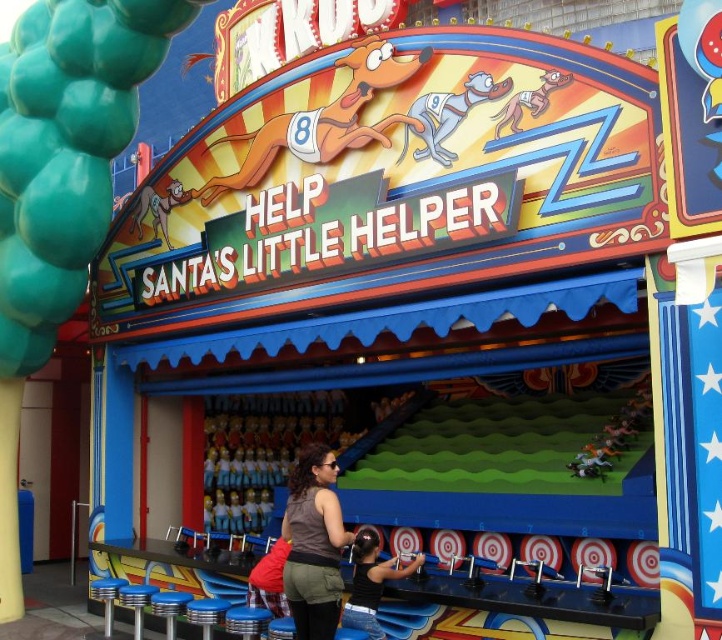
Question: Can you confirm if gray fabric dog at center is bigger than matte yellow dog at upper center?

Choices:
 (A) yes
 (B) no

Answer: (A)

Question: Can you confirm if matte orange dog at center is positioned to the right of black t-shirt at center?

Choices:
 (A) no
 (B) yes

Answer: (A)

Question: Based on their relative distances, which object is nearer to the matte orange dog at center?

Choices:
 (A) gray fabric dog at center
 (B) matte yellow dog at upper center

Answer: (A)

Question: Which object appears closest to the camera in this image?

Choices:
 (A) matte yellow dog at upper center
 (B) matte orange dog at center
 (C) gray fabric dog at center
 (D) brown fabric shirt at center

Answer: (A)

Question: Which point appears closest to the camera in this image?

Choices:
 (A) (435, 138)
 (B) (287, 141)

Answer: (A)

Question: Does black t-shirt at center appear over matte yellow dog at upper center?

Choices:
 (A) no
 (B) yes

Answer: (A)